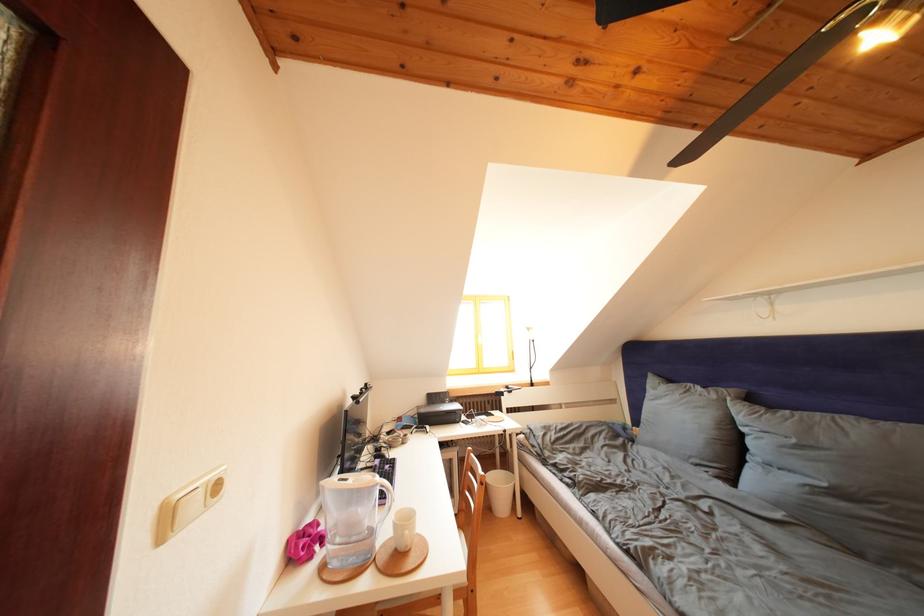
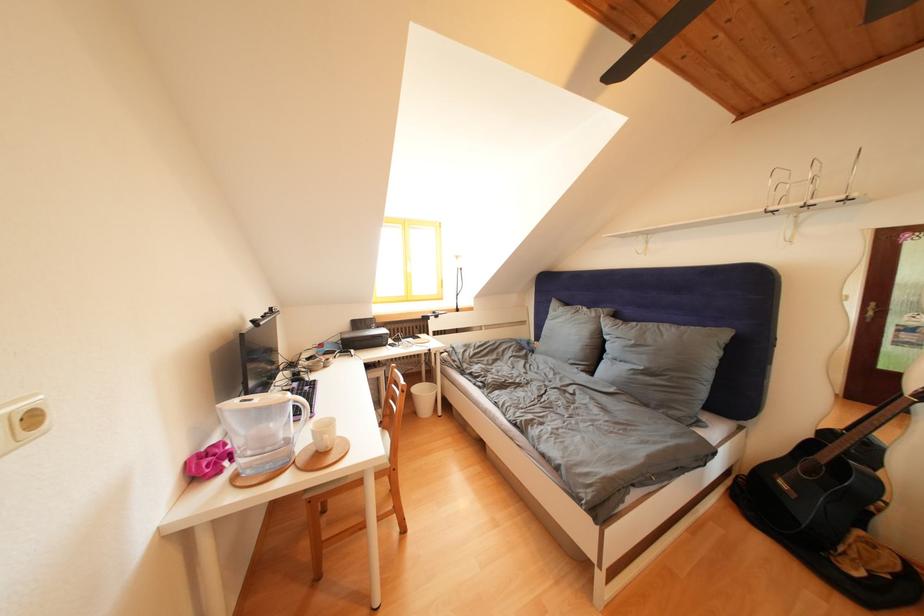
Locate, in the second image, the point that corresponds to [319,523] in the first image.

(223, 446)